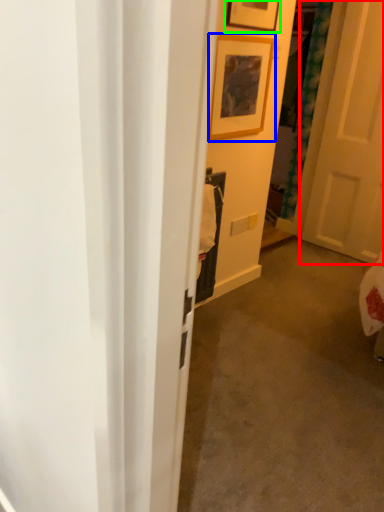
Question: Which object is positioned closest to door (highlighted by a red box)? Select from picture frame (highlighted by a blue box) and picture frame (highlighted by a green box).

Choices:
 (A) picture frame
 (B) picture frame

Answer: (A)